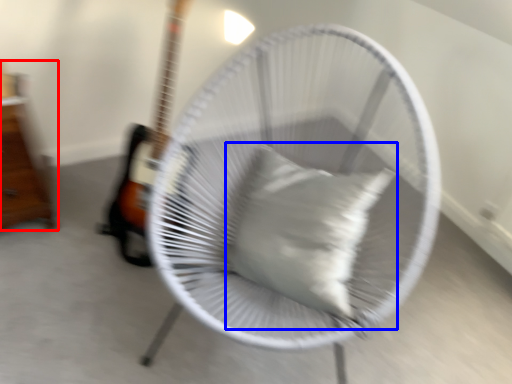
Question: Which of the following is the closest to the observer, furniture (highlighted by a red box) or pillow (highlighted by a blue box)?

Choices:
 (A) furniture
 (B) pillow

Answer: (B)